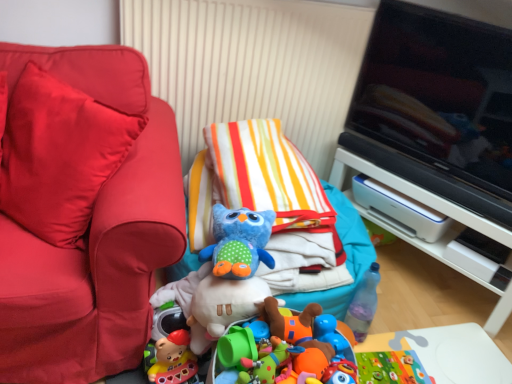
Question: Considering the relative sizes of black glossy television at upper right and matte red couch at left, the 2th furniture positioned from the back, in the image provided, is black glossy television at upper right taller than matte red couch at left, the 2th furniture positioned from the back,?

Choices:
 (A) no
 (B) yes

Answer: (B)

Question: From the image's perspective, is black glossy television at upper right located beneath matte red couch at left, which appears as the 1th furniture when viewed from the left?

Choices:
 (A) no
 (B) yes

Answer: (A)

Question: Is black glossy television at upper right oriented away from matte red couch at left, placed as the second furniture when sorted from right to left?

Choices:
 (A) no
 (B) yes

Answer: (A)

Question: Does black glossy television at upper right have a lesser height compared to matte red couch at left, the 2th furniture positioned from the back?

Choices:
 (A) no
 (B) yes

Answer: (A)

Question: From the image's perspective, does black glossy television at upper right appear higher than matte red couch at left, marked as the first furniture in a front-to-back arrangement?

Choices:
 (A) yes
 (B) no

Answer: (A)

Question: Considering the positions of white plastic printer at right, placed as the 1th furniture when sorted from back to front, and blue plush owl at center, which is the first toy from front to back, in the image, is white plastic printer at right, placed as the 1th furniture when sorted from back to front, taller or shorter than blue plush owl at center, which is the first toy from front to back,?

Choices:
 (A) short
 (B) tall

Answer: (B)

Question: Is point (452, 210) closer or farther from the camera than point (216, 231)?

Choices:
 (A) closer
 (B) farther

Answer: (B)

Question: In the image, is white plastic printer at right, positioned as the 2th furniture in front-to-back order, positioned in front of or behind blue plush owl at center, which is the first toy from front to back?

Choices:
 (A) behind
 (B) front

Answer: (A)

Question: Is white plastic printer at right, the 1th furniture viewed from the right, bigger or smaller than blue plush owl at center, acting as the first toy starting from the left?

Choices:
 (A) big
 (B) small

Answer: (A)

Question: From the image's perspective, is blue rubber duck at center, the 2th toy in the front-to-back sequence, located above or below black glossy television at upper right?

Choices:
 (A) below
 (B) above

Answer: (A)

Question: Considering the positions of point (338, 347) and point (373, 77), is point (338, 347) closer or farther from the camera than point (373, 77)?

Choices:
 (A) farther
 (B) closer

Answer: (B)

Question: From a real-world perspective, is blue rubber duck at center, acting as the first toy starting from the bottom, above or below black glossy television at upper right?

Choices:
 (A) above
 (B) below

Answer: (B)

Question: Do you think blue rubber duck at center, placed as the 1th toy when sorted from back to front, is within black glossy television at upper right, or outside of it?

Choices:
 (A) inside
 (B) outside

Answer: (B)

Question: From a real-world perspective, is blue plush owl at center, which is the first toy from front to back, above or below black glossy television at upper right?

Choices:
 (A) below
 (B) above

Answer: (A)

Question: Would you say blue plush owl at center, acting as the first toy starting from the left, is inside or outside black glossy television at upper right?

Choices:
 (A) inside
 (B) outside

Answer: (B)